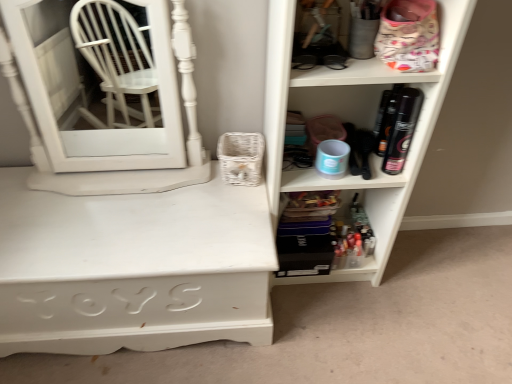
You are a GUI agent. You are given a task and a screenshot of the screen. Output one action in this format:
    pyautogui.click(x=<x>, y=<y>)
    Task: Click on the vacant area in front of white glossy medicine cabinet at left
    The image size is (512, 384).
    Given the screenshot: What is the action you would take?
    pyautogui.click(x=105, y=225)